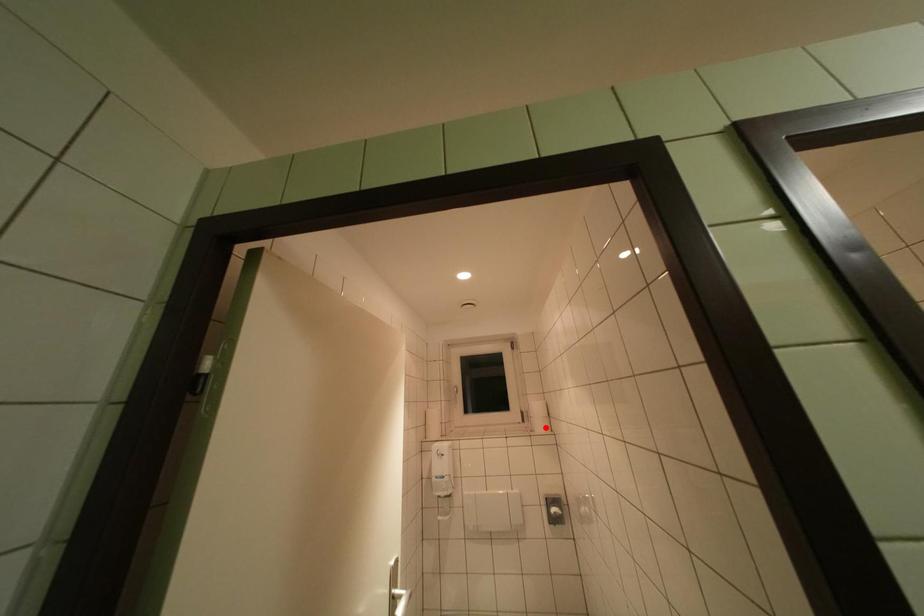
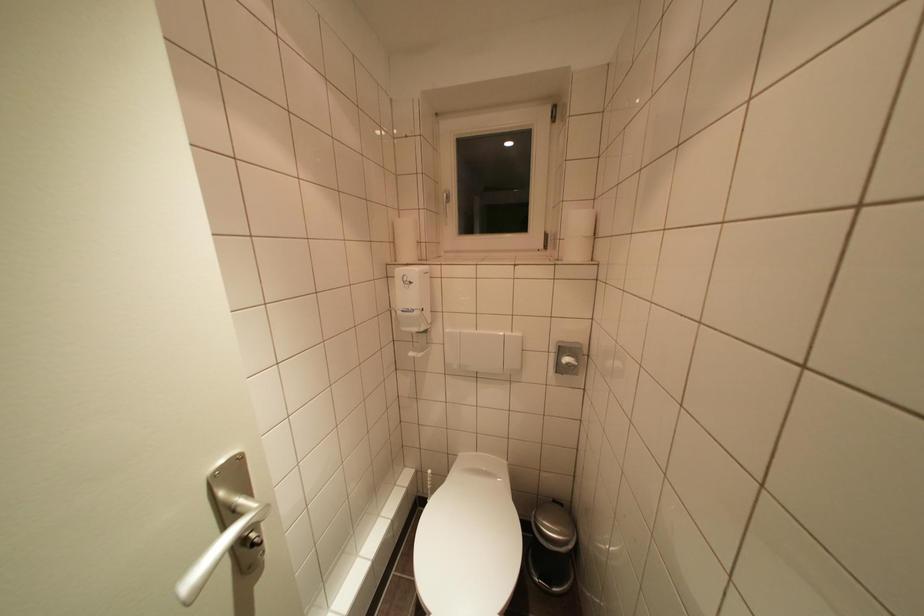
Question: I am providing you with two images of the same scene from different viewpoints. Given a red point in image1, look at the same physical point in image2. Is it:

Choices:
 (A) Closer to the viewpoint
 (B) Farther from the viewpoint

Answer: (A)